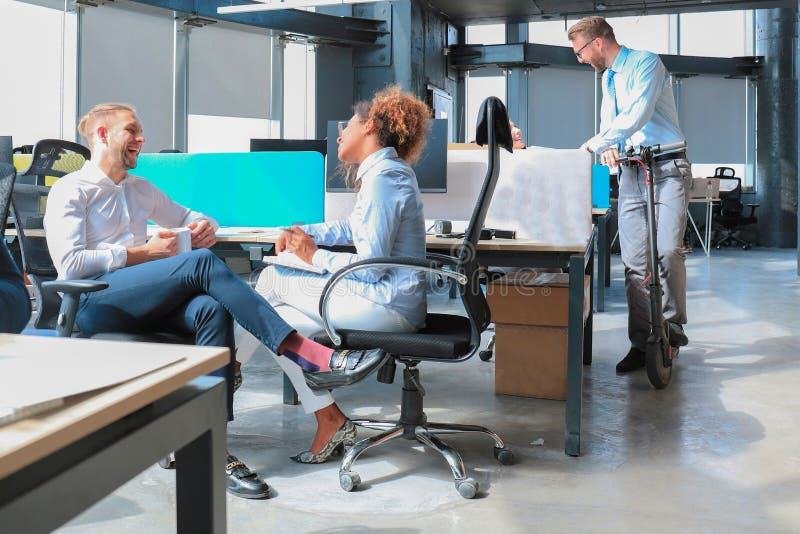
Where is `computer monitor`? This screenshot has height=534, width=800. computer monitor is located at coordinates (437, 152), (328, 121), (324, 177), (437, 179).